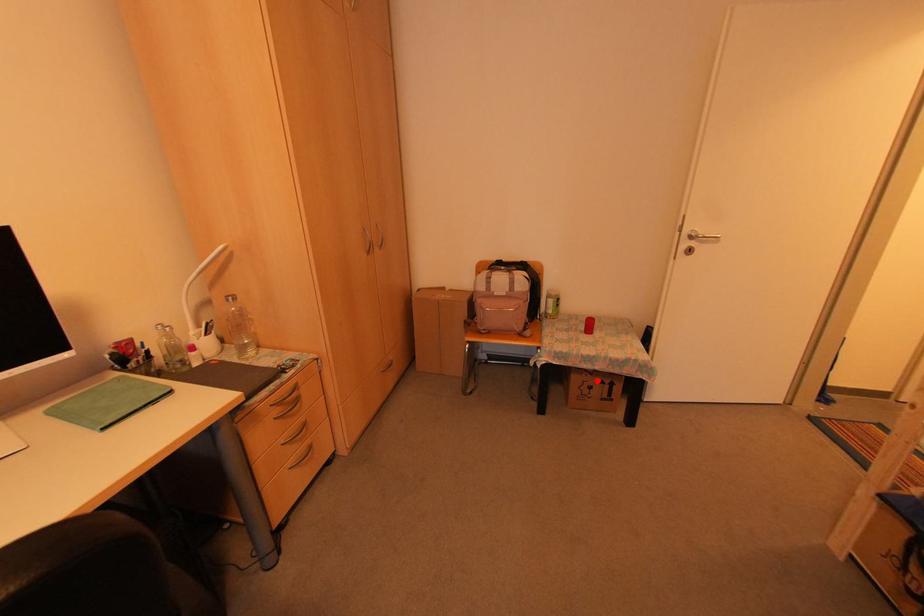
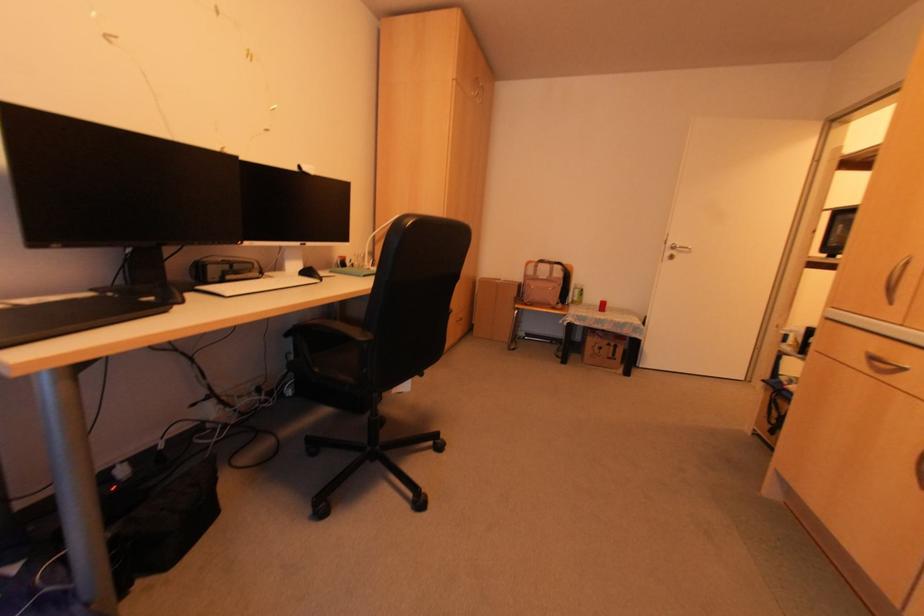
In the second image, find the point that corresponds to the highlighted location in the first image.

(604, 342)